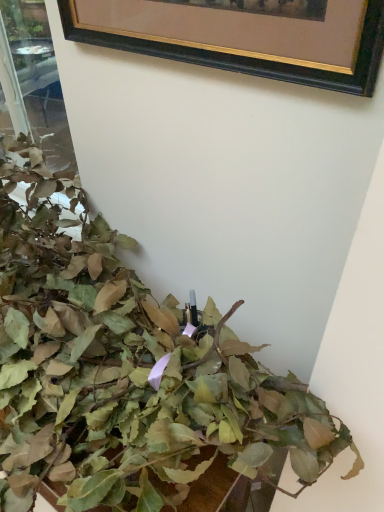
This screenshot has height=512, width=384. What are the coordinates of `green matte leaves at lower left` in the screenshot? It's located at (124, 370).

What do you see at coordinates (124, 370) in the screenshot?
I see `green matte leaves at lower left` at bounding box center [124, 370].

At what (x,y) coordinates should I click in order to perform the action: click on green matte leaves at lower left. Please return your answer as a coordinate pair (x, y). Looking at the image, I should click on pos(124,370).